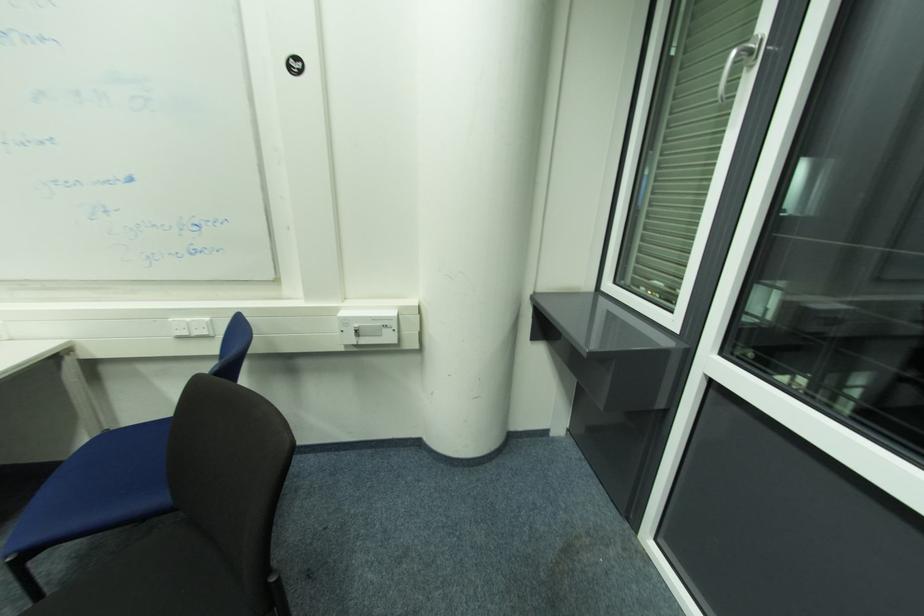
What do you see at coordinates (368, 326) in the screenshot? I see `the white switch box cover` at bounding box center [368, 326].